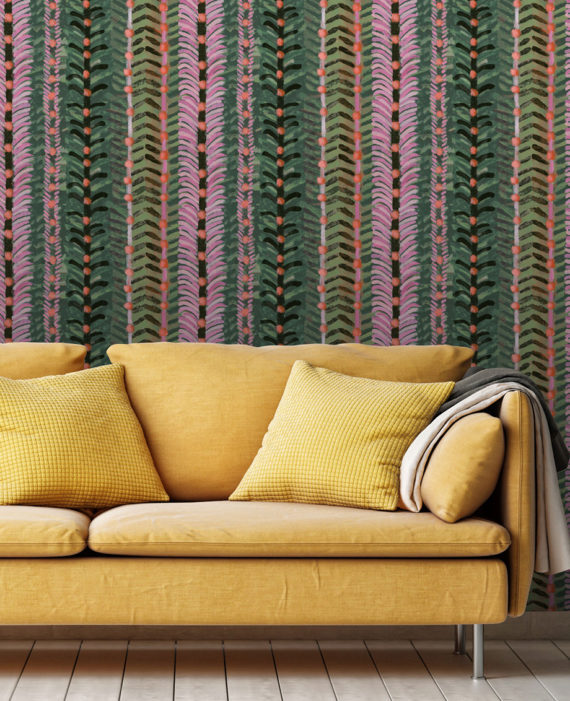
What are the coordinates of `back cushions` in the screenshot? It's located at (30, 362), (193, 397).